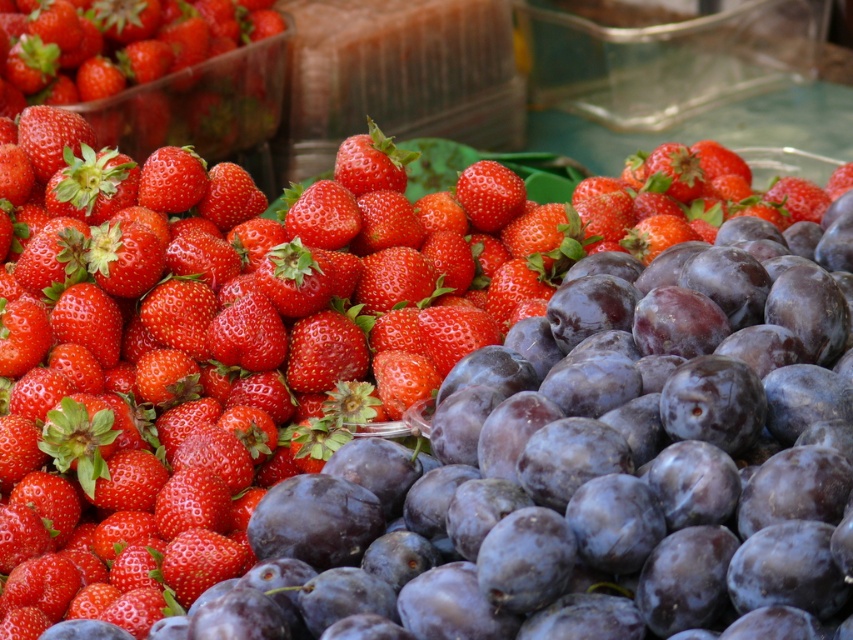
Question: Does matte red strawberry at center appear under matte red strawberry at upper left?

Choices:
 (A) yes
 (B) no

Answer: (B)

Question: Among these objects, which one is nearest to the camera?

Choices:
 (A) matte red strawberry at upper left
 (B) shiny red strawberries at upper left

Answer: (A)

Question: Which of the following is the closest to the observer?

Choices:
 (A) matte red strawberry at center
 (B) shiny red strawberries at upper left
 (C) glossy red strawberry at center

Answer: (A)

Question: Which of the following is the farthest from the observer?

Choices:
 (A) (202, 180)
 (B) (122, 145)
 (C) (473, 192)

Answer: (B)

Question: Does shiny red strawberries at upper left have a smaller size compared to matte red strawberry at center?

Choices:
 (A) yes
 (B) no

Answer: (B)

Question: Is matte red strawberry at upper left bigger than glossy red strawberry at center?

Choices:
 (A) no
 (B) yes

Answer: (B)